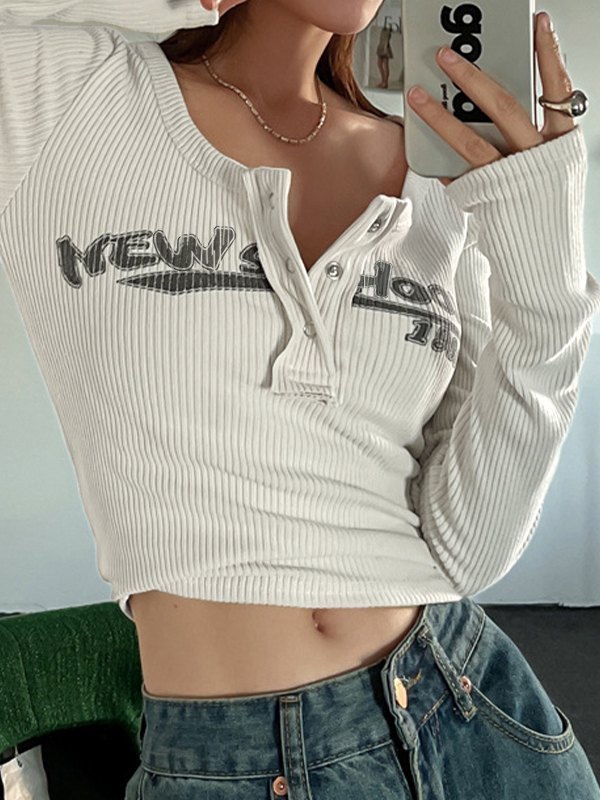
This screenshot has height=800, width=600. I want to click on phone, so click(517, 18).